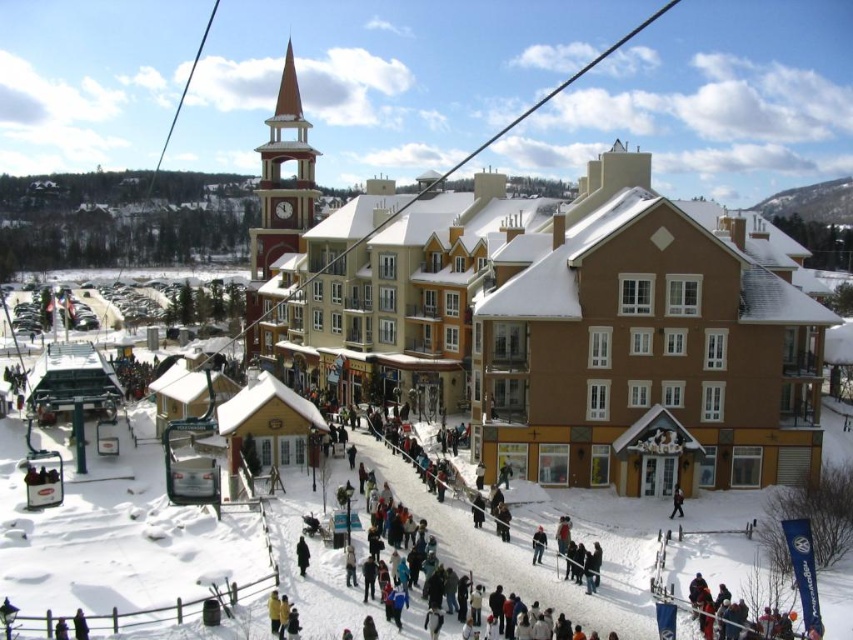
What are the coordinates of the brown wooden building at center?

The coordinates of the brown wooden building at center are 0.506 in the x direction and 0.669 in the y direction.

You are a photographer trying to capture the brown wooden building at center and the dark gray jacket at center in the same frame. Which object should you focus on first if you want to ensure both are fully visible in your photo?

The brown wooden building at center is wider than the dark gray jacket at center, so focusing on the building first will help ensure both objects are fully visible in the frame.

You are standing in the winter scene and want to take a photo of the brown wooden building at center and the dark gray jacket at center. Which object should you focus on first if you want to capture both in the same frame without moving the camera?

You should focus on the dark gray jacket at center first because the brown wooden building at center is above it, so adjusting the camera to include the building above might require a wider angle or ensuring the jacket is in the lower part of the frame.